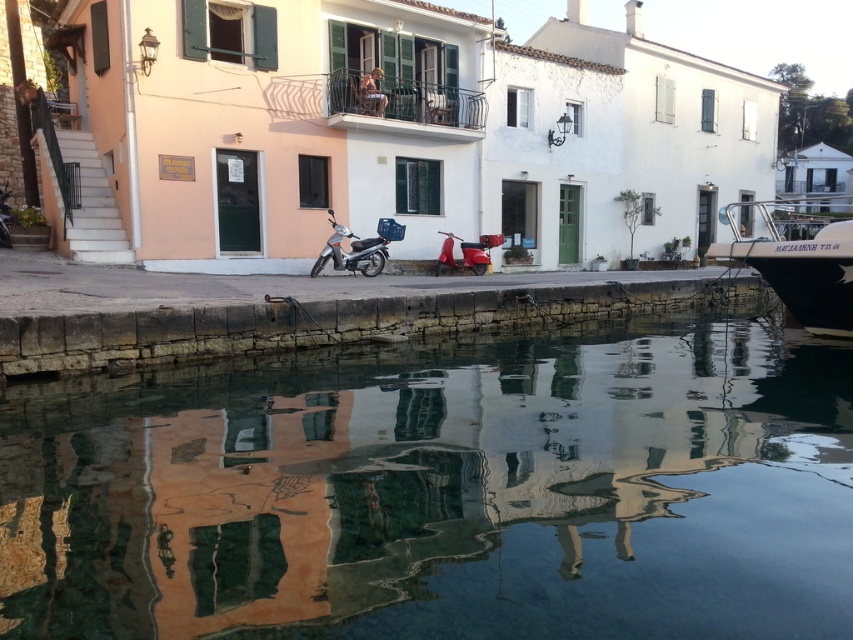
I want to click on transparent glass water at center, so click(x=440, y=492).

Describe the element at coordinates (440, 492) in the screenshot. I see `transparent glass water at center` at that location.

Where is `transparent glass water at center`? This screenshot has width=853, height=640. transparent glass water at center is located at coordinates (440, 492).

The image size is (853, 640). Describe the element at coordinates (351, 252) in the screenshot. I see `metallic silver scooter at center` at that location.

Between point (370, 259) and point (473, 262), which one is positioned in front?

Positioned in front is point (370, 259).

Identify the location of metallic silver scooter at center. The width and height of the screenshot is (853, 640). (351, 252).

Between transparent glass water at center and metallic silver boat at right, which one is positioned higher?

metallic silver boat at right is above.

Does transparent glass water at center have a larger size compared to metallic silver boat at right?

No, transparent glass water at center is not bigger than metallic silver boat at right.

Where is `transparent glass water at center`? transparent glass water at center is located at coordinates (440, 492).